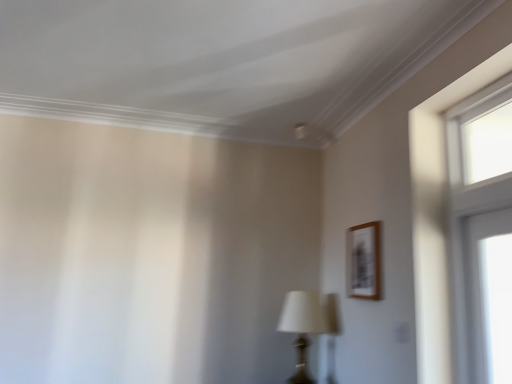
At what (x,y) coordinates should I click in order to perform the action: click on matte black table lamp at center. Please return your answer as a coordinate pair (x, y). The image size is (512, 384). Looking at the image, I should click on (302, 327).

Locate an element on the screen. This screenshot has width=512, height=384. clear glass window at upper right is located at coordinates (477, 213).

In order to click on matte black table lamp at center in this screenshot , I will do `click(302, 327)`.

Is wooden frame at upper right positioned with its back to clear glass window at upper right?

That's not correct — wooden frame at upper right is not looking away from clear glass window at upper right.

Is there a large distance between wooden frame at upper right and clear glass window at upper right?

They are positioned close to each other.

Which of these two, wooden frame at upper right or clear glass window at upper right, is thinner?

wooden frame at upper right.

How many degrees apart are the facing directions of wooden frame at upper right and clear glass window at upper right?

The facing directions of wooden frame at upper right and clear glass window at upper right are 0.763 degrees apart.

From a real-world perspective, is matte black table lamp at center located higher than wooden frame at upper right?

Incorrect, from a real-world perspective, matte black table lamp at center is lower than wooden frame at upper right.

Is matte black table lamp at center aimed at wooden frame at upper right?

No, matte black table lamp at center is not aimed at wooden frame at upper right.

In the image, is matte black table lamp at center on the left side or the right side of wooden frame at upper right?

In the image, matte black table lamp at center appears on the left side of wooden frame at upper right.

At what (x,y) coordinates should I click in order to perform the action: click on window lying on the right of matte black table lamp at center. Please return your answer as a coordinate pair (x, y). Image resolution: width=512 pixels, height=384 pixels. Looking at the image, I should click on (477, 213).

Is point (302, 320) positioned behind point (453, 152)?

Yes.

From a real-world perspective, is matte black table lamp at center on clear glass window at upper right?

Actually, matte black table lamp at center is physically below clear glass window at upper right in the real world.

In the scene shown: Is wooden frame at upper right located outside matte black table lamp at center?

wooden frame at upper right lies outside matte black table lamp at center's area.

Considering the sizes of objects wooden frame at upper right and matte black table lamp at center in the image provided, who is wider, wooden frame at upper right or matte black table lamp at center?

matte black table lamp at center is wider.

From a real-world perspective, between wooden frame at upper right and matte black table lamp at center, who is vertically higher?

wooden frame at upper right, from a real-world perspective.

Does wooden frame at upper right have a larger size compared to matte black table lamp at center?

Actually, wooden frame at upper right might be smaller than matte black table lamp at center.

Could you tell me if clear glass window at upper right is facing wooden frame at upper right?

No.

Are clear glass window at upper right and wooden frame at upper right far apart?

No, clear glass window at upper right is not far away from wooden frame at upper right.

Where is `window that is above the wooden frame at upper right (from a real-world perspective)`? window that is above the wooden frame at upper right (from a real-world perspective) is located at coordinates [x=477, y=213].

From a real-world perspective, which is physically below, clear glass window at upper right or wooden frame at upper right?

wooden frame at upper right is physically lower.

Between clear glass window at upper right and matte black table lamp at center, which one has less height?

With less height is matte black table lamp at center.

This screenshot has width=512, height=384. In order to click on window above the matte black table lamp at center (from a real-world perspective) in this screenshot , I will do `click(477, 213)`.

The image size is (512, 384). In order to click on picture frame beneath the clear glass window at upper right (from a real-world perspective) in this screenshot , I will do `click(362, 261)`.

At what (x,y) coordinates should I click in order to perform the action: click on picture frame on the right of matte black table lamp at center. Please return your answer as a coordinate pair (x, y). This screenshot has width=512, height=384. Looking at the image, I should click on pyautogui.click(x=362, y=261).

Considering their positions, is clear glass window at upper right positioned closer to matte black table lamp at center than wooden frame at upper right?

wooden frame at upper right is closer to matte black table lamp at center.

From the image, which object appears to be farther from clear glass window at upper right, matte black table lamp at center or wooden frame at upper right?

Based on the image, matte black table lamp at center appears to be further to clear glass window at upper right.

When comparing their distances from wooden frame at upper right, does clear glass window at upper right or matte black table lamp at center seem further?

Among the two, clear glass window at upper right is located further to wooden frame at upper right.

When comparing their distances from clear glass window at upper right, does wooden frame at upper right or matte black table lamp at center seem closer?

Based on the image, wooden frame at upper right appears to be nearer to clear glass window at upper right.

When comparing their distances from wooden frame at upper right, does matte black table lamp at center or clear glass window at upper right seem further?

clear glass window at upper right.

Considering their positions, is wooden frame at upper right positioned closer to matte black table lamp at center than clear glass window at upper right?

wooden frame at upper right.

Image resolution: width=512 pixels, height=384 pixels. I want to click on picture frame located between clear glass window at upper right and matte black table lamp at center in the depth direction, so click(x=362, y=261).